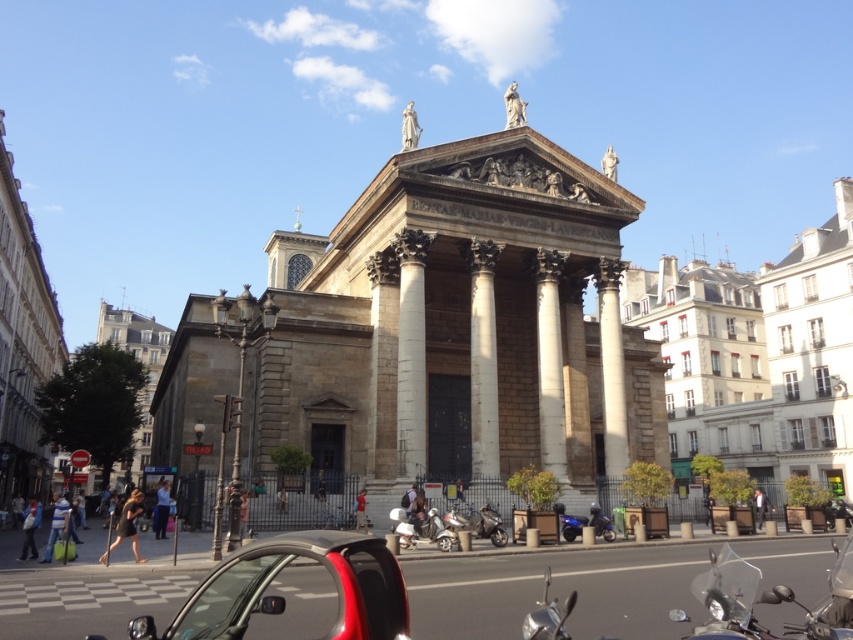
What do you see at coordinates (294, 593) in the screenshot?
I see `shiny red car at lower center` at bounding box center [294, 593].

Between shiny red car at lower center and shiny chrome motorcycle at lower center, which one has more height?

Standing taller between the two is shiny red car at lower center.

Is point (387, 586) farther from viewer compared to point (412, 528)?

No, (387, 586) is in front of (412, 528).

Find the location of a particular element. shiny red car at lower center is located at coordinates (294, 593).

The image size is (853, 640). What do you see at coordinates (477, 522) in the screenshot?
I see `metallic silver scooter at center` at bounding box center [477, 522].

Is metallic silver scooter at center bigger than shiny blue motorcycle at lower center?

Yes.

Which is behind, point (474, 513) or point (606, 532)?

Positioned behind is point (474, 513).

The height and width of the screenshot is (640, 853). Identify the location of metallic silver scooter at center. (477, 522).

Does shiny chrome motorcycle at lower right appear over metallic silver scooter at center?

Yes.

Who is shorter, shiny chrome motorcycle at lower right or metallic silver scooter at center?

With less height is metallic silver scooter at center.

Does point (724, 632) come closer to viewer compared to point (480, 520)?

That is True.

This screenshot has height=640, width=853. I want to click on shiny chrome motorcycle at lower right, so click(x=758, y=602).